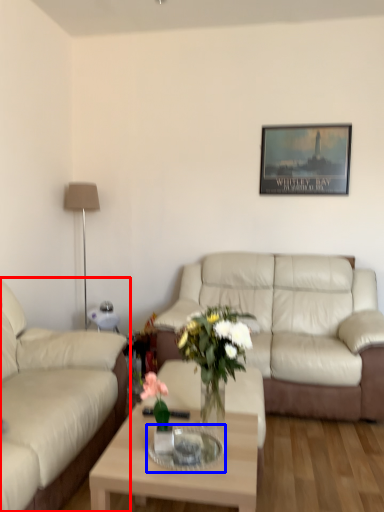
Question: Which object appears closest to the camera in this image, studio couch (highlighted by a red box) or glass table (highlighted by a blue box)?

Choices:
 (A) studio couch
 (B) glass table

Answer: (A)